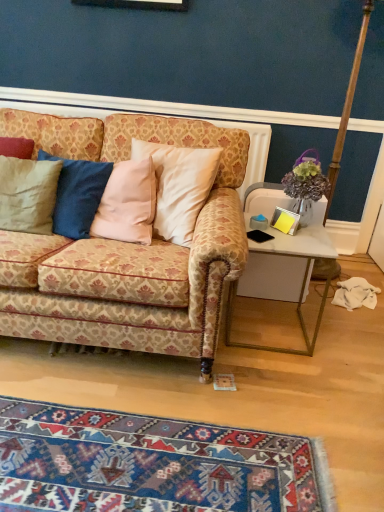
Locate an element on the screen. The height and width of the screenshot is (512, 384). blue woven rug at lower center is located at coordinates (152, 464).

Measure the distance between patterned fabric couch at center and camera.

The distance of patterned fabric couch at center from camera is 4.69 feet.

What are the coordinates of `white glossy desk at right` in the screenshot? It's located at (302, 280).

Image resolution: width=384 pixels, height=512 pixels. Identify the location of pole above the matte beige pillow at left (from the image's perspective). (347, 106).

From the image's perspective, is matte beige pillow at left located above or below wooden pole at right?

Clearly, from the image's perspective, matte beige pillow at left is below wooden pole at right.

Visually, is matte beige pillow at left positioned to the left or to the right of wooden pole at right?

matte beige pillow at left is positioned on wooden pole at right's left side.

Which object is closer to the camera, matte beige pillow at left or wooden pole at right?

matte beige pillow at left is closer to the camera.

From a real-world perspective, which object stands above the other?

From a 3D spatial view, wooden pole at right is above.

Is the surface of white glossy desk at right in direct contact with wooden pole at right?

white glossy desk at right and wooden pole at right are not in contact.

Considering the relative sizes of white glossy desk at right and wooden pole at right in the image provided, is white glossy desk at right thinner than wooden pole at right?

Indeed, white glossy desk at right has a lesser width compared to wooden pole at right.

Where is `desk lying below the wooden pole at right (from the image's perspective)`? desk lying below the wooden pole at right (from the image's perspective) is located at coordinates (302, 280).

Is blue woven rug at lower center bigger than patterned fabric couch at center?

No.

Which object is wider, blue woven rug at lower center or patterned fabric couch at center?

patterned fabric couch at center.

From the image's perspective, is blue woven rug at lower center on top of patterned fabric couch at center?

No.

Does point (6, 508) appear closer or farther from the camera than point (26, 117)?

Point (6, 508) is closer to the camera than point (26, 117).

Is patterned fabric couch at center inside or outside of blue woven rug at lower center?

patterned fabric couch at center exists outside the volume of blue woven rug at lower center.

Does patterned fabric couch at center turn towards blue woven rug at lower center?

Yes, patterned fabric couch at center is oriented towards blue woven rug at lower center.

Which point is more forward, (207, 143) or (322, 454)?

Point (322, 454)

Consider the image. From a real-world perspective, who is located higher, patterned fabric couch at center or blue woven rug at lower center?

From a 3D spatial view, patterned fabric couch at center is above.

From the picture: From the image's perspective, is patterned fabric couch at center over wooden pole at right?

No, from the image's perspective, patterned fabric couch at center is not on top of wooden pole at right.

Is patterned fabric couch at center looking in the opposite direction of wooden pole at right?

patterned fabric couch at center is not turned away from wooden pole at right.

In the scene shown: Between patterned fabric couch at center and wooden pole at right, which one has more height?

wooden pole at right.

Between patterned fabric couch at center and wooden pole at right, which one has larger size?

patterned fabric couch at center is bigger.

Which is more distant, [123,420] or [26,190]?

Positioned behind is point [26,190].

Is blue woven rug at lower center facing towards matte beige pillow at left?

No, blue woven rug at lower center does not turn towards matte beige pillow at left.

Identify the location of pillow behind the blue woven rug at lower center. The image size is (384, 512). (28, 194).

Based on the photo, can you tell me how much blue woven rug at lower center and matte beige pillow at left differ in facing direction?

The facing directions of blue woven rug at lower center and matte beige pillow at left are 179 degrees apart.

Is matte beige pillow at left thinner than white glossy desk at right?

Yes.

Can you tell me how much matte beige pillow at left and white glossy desk at right differ in facing direction?

matte beige pillow at left and white glossy desk at right are facing 0.843 degrees away from each other.

From the image's perspective, which one is positioned lower, matte beige pillow at left or white glossy desk at right?

From the image's view, white glossy desk at right is below.

Is matte beige pillow at left touching white glossy desk at right?

No, matte beige pillow at left is not in contact with white glossy desk at right.

There is a matte beige pillow at left. Where is `pole above it (from a real-world perspective)`? pole above it (from a real-world perspective) is located at coordinates (347, 106).

This screenshot has height=512, width=384. What are the coordinates of `pole that is behind the white glossy desk at right` in the screenshot? It's located at (347, 106).

Estimate the real-world distances between objects in this image. Which object is closer to white glossy desk at right, patterned fabric couch at center or matte beige pillow at left?

The object closer to white glossy desk at right is patterned fabric couch at center.

Consider the image. Which object lies nearer to the anchor point wooden pole at right, white glossy desk at right or blue woven rug at lower center?

Among the two, white glossy desk at right is located nearer to wooden pole at right.

When comparing their distances from matte beige pillow at left, does white glossy desk at right or wooden pole at right seem closer?

Based on the image, white glossy desk at right appears to be nearer to matte beige pillow at left.

Considering their positions, is wooden pole at right positioned closer to white glossy desk at right than patterned fabric couch at center?

patterned fabric couch at center is positioned closer to the anchor white glossy desk at right.

Based on their spatial positions, is matte beige pillow at left or blue woven rug at lower center further from white glossy desk at right?

Based on the image, matte beige pillow at left appears to be further to white glossy desk at right.

Which object lies further to the anchor point patterned fabric couch at center, white glossy desk at right or blue woven rug at lower center?

Based on the image, blue woven rug at lower center appears to be further to patterned fabric couch at center.

Which object lies further to the anchor point patterned fabric couch at center, white glossy desk at right or matte beige pillow at left?

→ white glossy desk at right.

From the image, which object appears to be farther from blue woven rug at lower center, white glossy desk at right or wooden pole at right?

Among the two, wooden pole at right is located further to blue woven rug at lower center.

The height and width of the screenshot is (512, 384). I want to click on mat situated between patterned fabric couch at center and wooden pole at right from left to right, so click(x=152, y=464).

At what (x,y) coordinates should I click in order to perform the action: click on desk situated between patterned fabric couch at center and wooden pole at right from left to right. Please return your answer as a coordinate pair (x, y). Image resolution: width=384 pixels, height=512 pixels. Looking at the image, I should click on (302, 280).

I want to click on studio couch between matte beige pillow at left and blue woven rug at lower center in the vertical direction, so click(x=126, y=250).

Locate an element on the screen. The width and height of the screenshot is (384, 512). mat between matte beige pillow at left and white glossy desk at right from left to right is located at coordinates (152, 464).